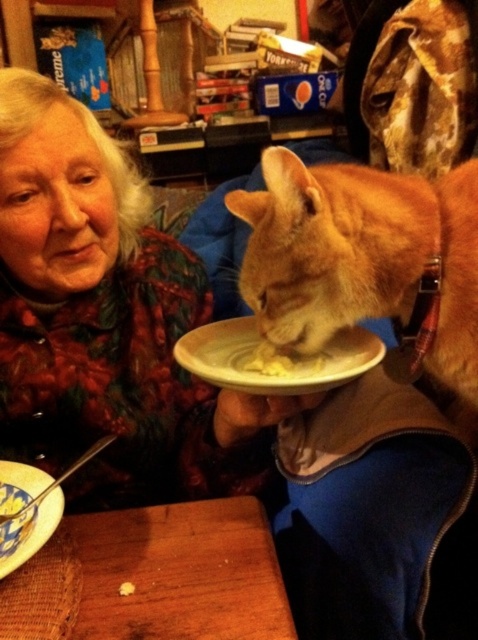
Between point (282, 227) and point (0, 492), which one is positioned behind?

The point (0, 492) is behind.

Is orange fur cat at center shorter than blue and yellow ceramic bowl at lower left?

No.

Describe the element at coordinates (365, 260) in the screenshot. The height and width of the screenshot is (640, 478). I see `orange fur cat at center` at that location.

What are the coordinates of `orange fur cat at center` in the screenshot? It's located at (365, 260).

Which is above, orange fur cat at center or yellow creamy food at plate center?

Positioned higher is orange fur cat at center.

Which is in front, point (432, 227) or point (249, 356)?

Point (432, 227)

Identify the location of orange fur cat at center. The width and height of the screenshot is (478, 640). (365, 260).

Which of these two, white matte plate at center or yellow creamy food at plate center, stands shorter?

With less height is yellow creamy food at plate center.

What do you see at coordinates (274, 369) in the screenshot? I see `white matte plate at center` at bounding box center [274, 369].

This screenshot has height=640, width=478. I want to click on white matte plate at center, so click(274, 369).